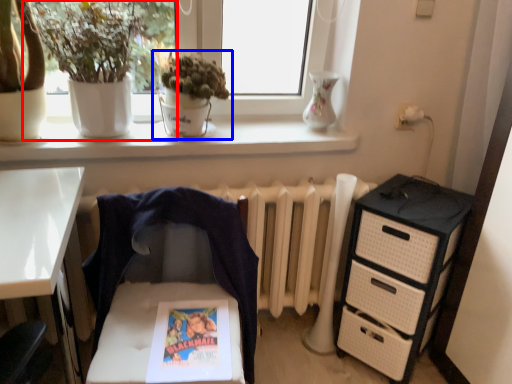
Question: Which of the following is the closest to the observer, houseplant (highlighted by a red box) or houseplant (highlighted by a blue box)?

Choices:
 (A) houseplant
 (B) houseplant

Answer: (A)